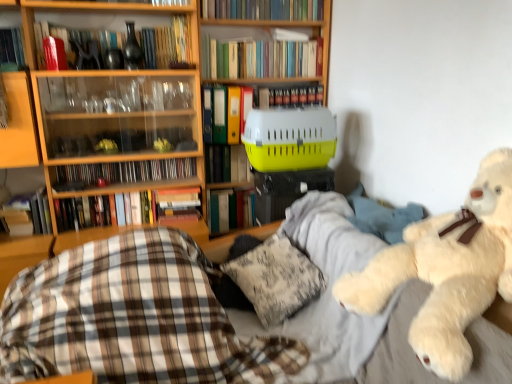
Question: In terms of width, does plaid fabric at lower left look wider or thinner when compared to hardcover books at upper center, positioned as the third book in top-to-bottom order?

Choices:
 (A) thin
 (B) wide

Answer: (B)

Question: Is plaid fabric at lower left bigger or smaller than hardcover books at upper center, positioned as the third book in top-to-bottom order?

Choices:
 (A) big
 (B) small

Answer: (A)

Question: Which object is the farthest from the hardcover book at center, the 7th book when ordered from top to bottom?

Choices:
 (A) hardcover book at upper center, the 1th book in the top-to-bottom sequence
 (B) matte black cd case at upper left, the 4th book when ordered from bottom to top
 (C) wooden bookcase at upper left
 (D) hardcover books at upper center, which ranks as the eighth book in bottom-to-top order
 (E) hardcover book at left, which is the ninth book from top to bottom

Answer: (A)

Question: Based on their relative distances, which object is nearer to the yellow plastic pet carrier at center?

Choices:
 (A) green matte folder at center, marked as the 6th book in a bottom-to-top arrangement
 (B) hardcover book at center, the 7th book when ordered from top to bottom
 (C) yellow plastic crate at center, the fifth book from the bottom
 (D) hardcover books at upper center, which is the 2th book from top to bottom
 (E) matte black cd case at upper left, the 4th book when ordered from bottom to top

Answer: (A)